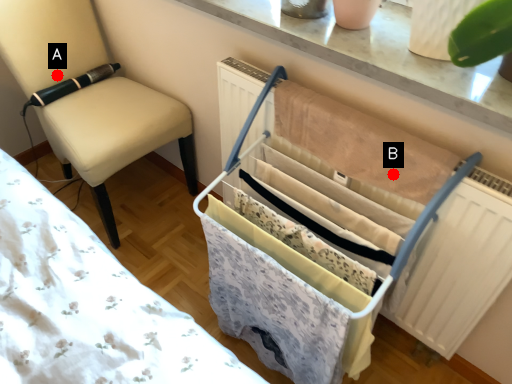
Question: Two points are circled on the image, labeled by A and B beside each circle. Among these points, which one is farthest from the camera?

Choices:
 (A) A is further
 (B) B is further

Answer: (A)